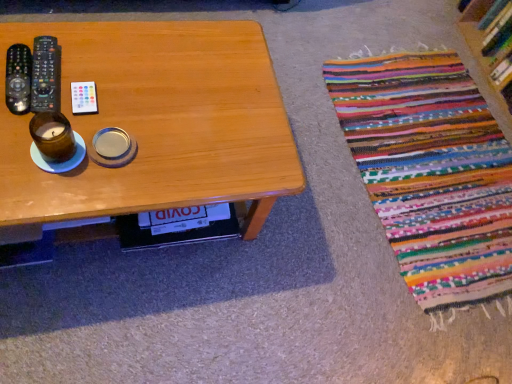
At what (x,y) coordinates should I click in order to perform the action: click on unoccupied space behind white plastic remote control at upper left, the third remote control when ordered from left to right. Please return your answer as a coordinate pair (x, y). The height and width of the screenshot is (384, 512). Looking at the image, I should click on (115, 56).